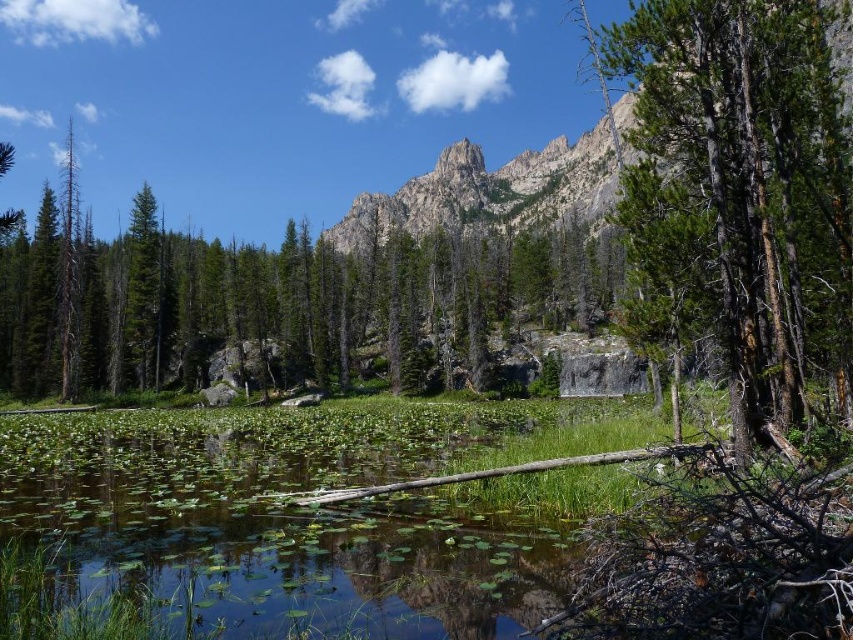
Question: Is green rough bark tree at right to the left of green textured rock at upper center from the viewer's perspective?

Choices:
 (A) no
 (B) yes

Answer: (A)

Question: Can you confirm if green rough bark tree at right is positioned above green leafy water at lower left?

Choices:
 (A) no
 (B) yes

Answer: (B)

Question: Among these points, which one is farthest from the camera?

Choices:
 (A) (526, 577)
 (B) (640, 333)
 (C) (196, 317)

Answer: (C)

Question: Can you confirm if green rough bark tree at right is positioned to the left of green leafy water at lower left?

Choices:
 (A) no
 (B) yes

Answer: (A)

Question: Which point appears closest to the camera in this image?

Choices:
 (A) (465, 524)
 (B) (798, 323)

Answer: (A)

Question: Which point is closer to the camera taking this photo?

Choices:
 (A) (183, 486)
 (B) (657, 310)
 (C) (376, 284)

Answer: (A)